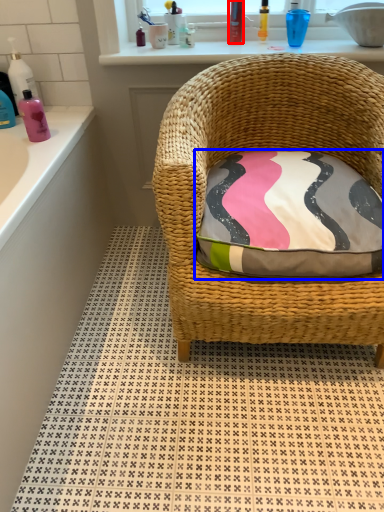
Question: Which object is closer to the camera taking this photo, toiletry (highlighted by a red box) or pillow (highlighted by a blue box)?

Choices:
 (A) toiletry
 (B) pillow

Answer: (B)